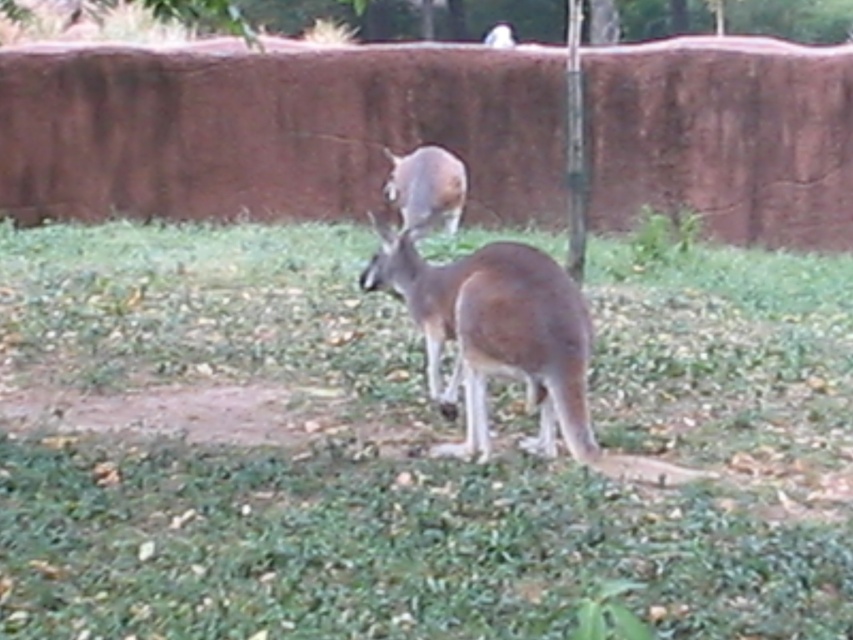
You are a zookeeper observing the kangaroos in their enclosure. You notice the green leafy tree at upper center and the brown fur kangaroo at center. Which object is closer to you, the observer?

The green leafy tree at upper center is closer to you because it is positioned further to the viewer than the brown fur kangaroo at center.

You are standing in the zoo enclosure with the two kangaroos. You notice two points marked in the scene. Which of the two points, point (440, 29) or point (427, 157), is closer to you?

Point (440, 29) is closer to you because it is further to the viewer than point (427, 157).

Consider the image. You are a zookeeper who needs to separate two kangaroos. You have a divider that is 12 feet long. The kangaroos are the brown furry kangaroo at center and the brown fur kangaroo at center. Can the divider fit between them to separate them?

The distance between the brown furry kangaroo at center and the brown fur kangaroo at center is 12.23 feet. The divider is 12 feet long, so it is slightly shorter than the required distance. Therefore, the divider cannot fully span the gap between them to separate them effectively.